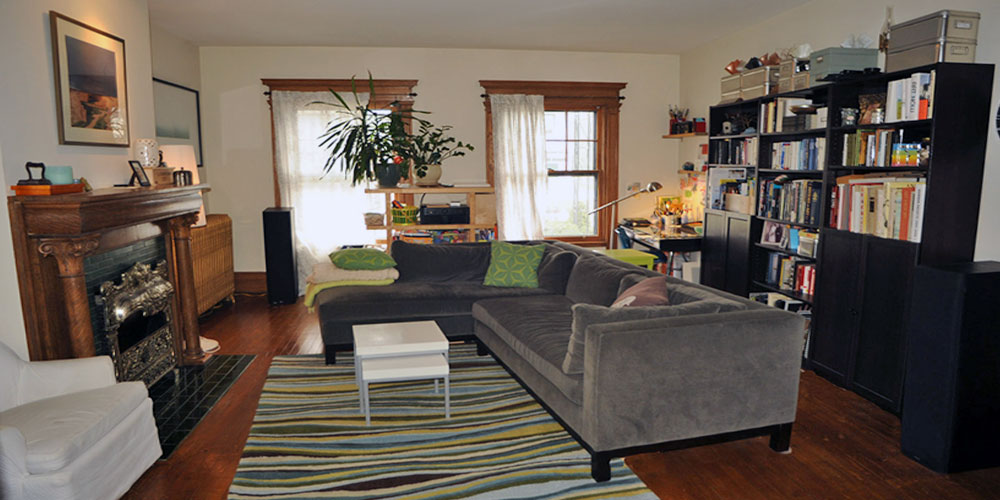
Locate an element on the screen. This screenshot has height=500, width=1000. green pillow is located at coordinates (525, 272).